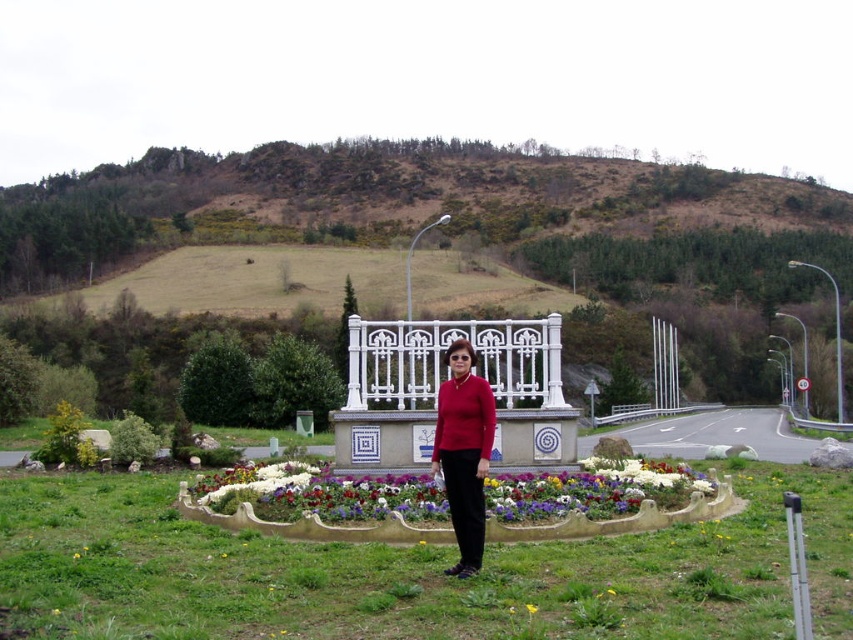
Question: Among these objects, which one is nearest to the camera?

Choices:
 (A) brown grassy hillside at upper center
 (B) yellow fabric flower at center

Answer: (B)

Question: Which object is closer to the camera taking this photo?

Choices:
 (A) brown grassy hillside at upper center
 (B) matte red sweater at center

Answer: (B)

Question: Does brown grassy hillside at upper center have a lesser width compared to glossy concrete flower bed at center?

Choices:
 (A) yes
 (B) no

Answer: (B)

Question: Which object is farther from the camera taking this photo?

Choices:
 (A) glossy concrete flower bed at center
 (B) yellow fabric flower at center
 (C) brown grassy hillside at upper center
 (D) matte red sweater at center

Answer: (C)

Question: Does matte red sweater at center appear on the right side of yellow fabric flower at center?

Choices:
 (A) no
 (B) yes

Answer: (A)

Question: Is brown grassy hillside at upper center above glossy concrete flower bed at center?

Choices:
 (A) yes
 (B) no

Answer: (A)